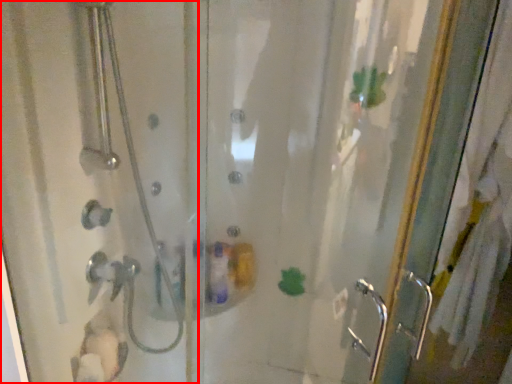
Question: From the image's perspective, what is the correct spatial relationship of shower door (annotated by the red box) in relation to screen door?

Choices:
 (A) above
 (B) below

Answer: (A)